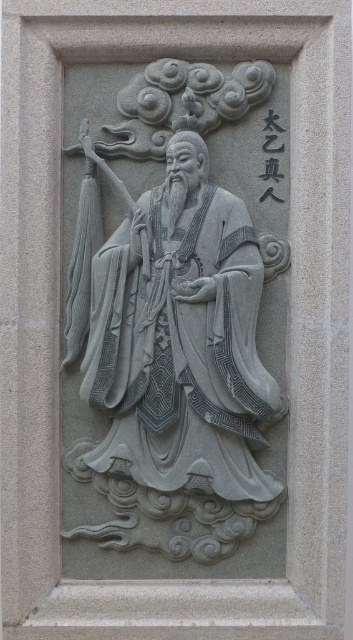
You are an archaeologist examining the stone relief sculpture. You notice the gray stone figure at center and the black stone text at upper right. Based on their positions, which object is closer to the right edge of the frame?

The black stone text at upper right is closer to the right edge of the frame because the gray stone figure at center is to the left of it.

You are an art conservator examining the stone relief sculpture. You need to determine which object is wider between the gray stone figure at center and the black stone text at upper right. Which one is wider?

The gray stone figure at center is wider than the black stone text at upper right.